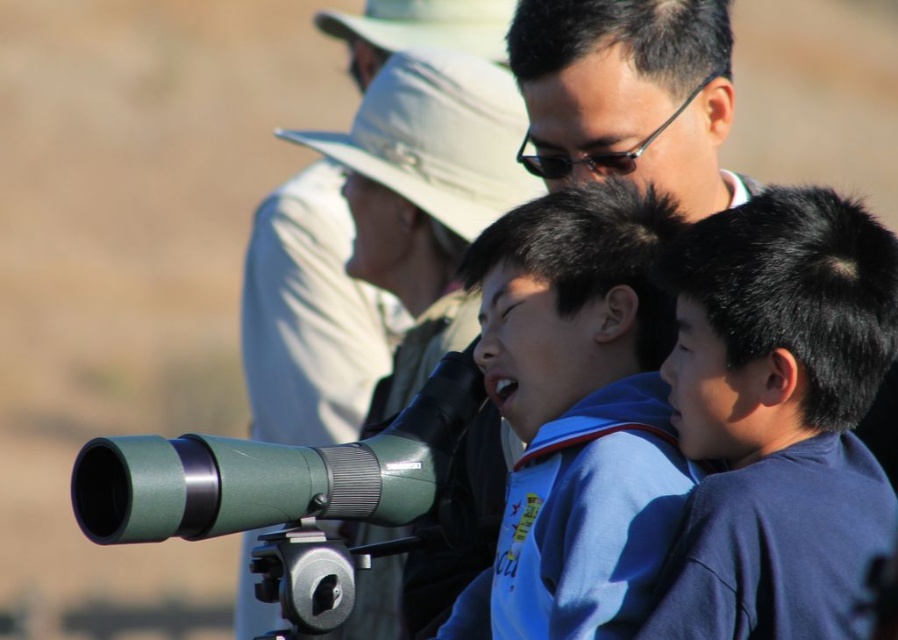
Does dark blue shirt at center lie in front of matte black binoculars at center?

Yes, it is in front of matte black binoculars at center.

Which is more to the left, dark blue shirt at center or matte black binoculars at center?

dark blue shirt at center

Locate an element on the screen. Image resolution: width=898 pixels, height=640 pixels. dark blue shirt at center is located at coordinates (779, 417).

Measure the distance between dark blue shirt at center and camera.

95.28 feet

Between point (749, 269) and point (590, 628), which one is positioned behind?

Positioned behind is point (749, 269).

Image resolution: width=898 pixels, height=640 pixels. I want to click on dark blue shirt at center, so click(x=779, y=417).

Can you confirm if blue fabric shirt at center is wider than matte black binoculars at center?

No, blue fabric shirt at center is not wider than matte black binoculars at center.

Is blue fabric shirt at center in front of matte black binoculars at center?

Yes, it is.

Is point (527, 212) positioned before point (650, 88)?

That is True.

Identify the location of blue fabric shirt at center. The height and width of the screenshot is (640, 898). (577, 413).